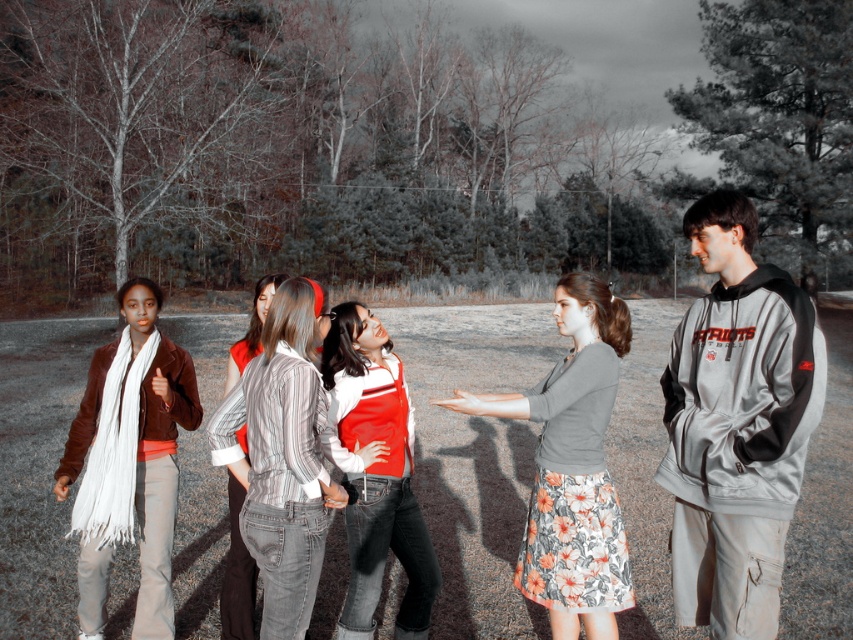
You are a photographer trying to capture a photo of the group in the park. You notice the floral cotton skirt at center and the red and white striped sweater at center. Which object should you focus on to ensure the other is in the background?

You should focus on the floral cotton skirt at center because it is closer to the viewer than the red and white striped sweater at center, so the sweater will naturally be in the background when the skirt is in focus.